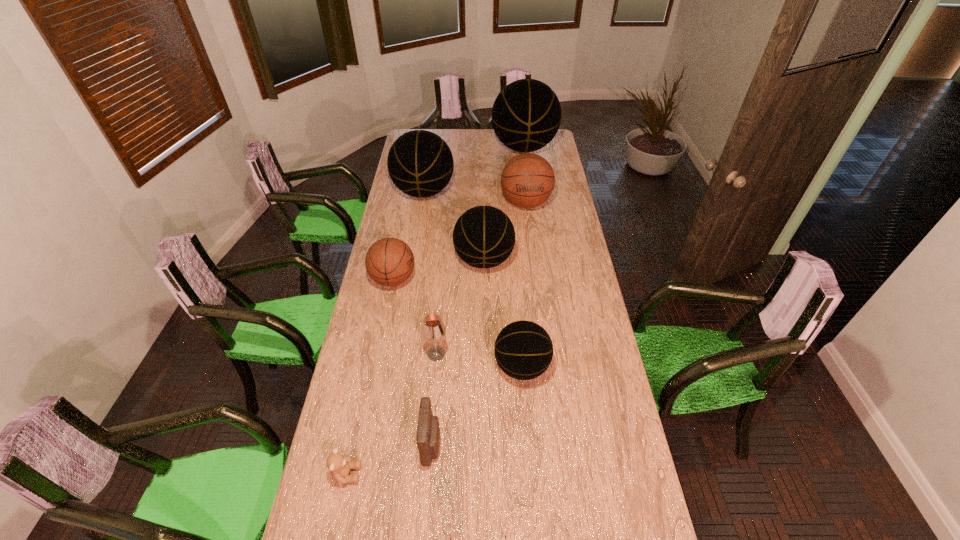
Where is `free location located 0.340m on the back of the nearest black basketball`? This screenshot has width=960, height=540. free location located 0.340m on the back of the nearest black basketball is located at coordinates (515, 279).

Identify the location of free space located 0.250m on the left of the wineglass. This screenshot has width=960, height=540. (355, 354).

At what (x,y) coordinates should I click in order to perform the action: click on free region located 0.190m with an open flap on the pouch. Please return your answer as a coordinate pair (x, y). Looking at the image, I should click on (503, 445).

Find the location of `vacant space situated 0.340m on the front-facing side of the teddy bear`. vacant space situated 0.340m on the front-facing side of the teddy bear is located at coordinates (x=476, y=474).

I want to click on object positioned at the far edge, so click(x=526, y=115).

This screenshot has width=960, height=540. In order to click on teddy bear located in the left edge section of the desktop in this screenshot , I will do `click(339, 465)`.

Where is `object positioned at the far right corner`? This screenshot has width=960, height=540. object positioned at the far right corner is located at coordinates (526, 115).

The width and height of the screenshot is (960, 540). I want to click on free space at the far edge of the desktop, so click(x=458, y=132).

Find the location of a particular element. free space at the left edge of the desktop is located at coordinates (407, 213).

Where is `free space at the right edge of the desktop`? The height and width of the screenshot is (540, 960). free space at the right edge of the desktop is located at coordinates (572, 314).